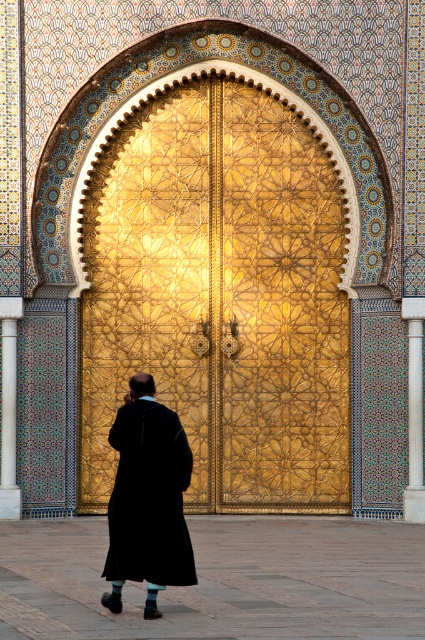
Question: Which point appears farthest from the camera in this image?

Choices:
 (A) (6, 499)
 (B) (121, 529)

Answer: (A)

Question: From the image, what is the correct spatial relationship of black woolen robe at center in relation to polished marble pillar at center?

Choices:
 (A) right
 (B) left

Answer: (A)

Question: Does gold textured door at center have a greater width compared to polished marble pillar at center?

Choices:
 (A) no
 (B) yes

Answer: (B)

Question: Which is farther from the white marble pillar at right?

Choices:
 (A) black woolen robe at center
 (B) polished marble pillar at center

Answer: (A)

Question: Which object appears closest to the camera in this image?

Choices:
 (A) gold textured door at center
 (B) white marble pillar at right
 (C) black woolen robe at center

Answer: (C)

Question: Is gold textured door at center positioned behind white marble pillar at right?

Choices:
 (A) yes
 (B) no

Answer: (A)